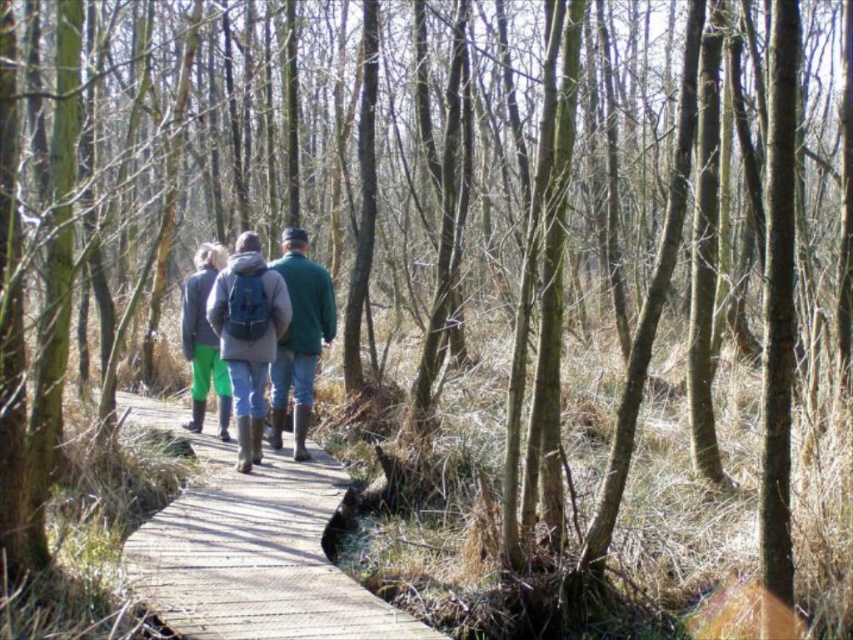
Can you confirm if wooden at center is taller than green fabric jacket at center?

Incorrect, wooden at center's height is not larger of green fabric jacket at center's.

The image size is (853, 640). Identify the location of wooden at center. (256, 556).

Does wooden at center have a greater height compared to green matte jacket at center?

Incorrect, wooden at center's height is not larger of green matte jacket at center's.

Who is lower down, wooden at center or green matte jacket at center?

wooden at center is lower down.

Is point (140, 595) closer to viewer compared to point (305, 396)?

That is True.

You are a GUI agent. You are given a task and a screenshot of the screen. Output one action in this format:
    pyautogui.click(x=<x>, y=<y>)
    Task: Click on the wooden at center
    The width and height of the screenshot is (853, 640).
    Given the screenshot: What is the action you would take?
    pyautogui.click(x=256, y=556)

Is green fabric jacket at center wider than green rubber boots at center?

Indeed, green fabric jacket at center has a greater width compared to green rubber boots at center.

Is point (280, 333) positioned before point (180, 344)?

Yes, point (280, 333) is closer to viewer.

The width and height of the screenshot is (853, 640). Identify the location of green fabric jacket at center. (270, 332).